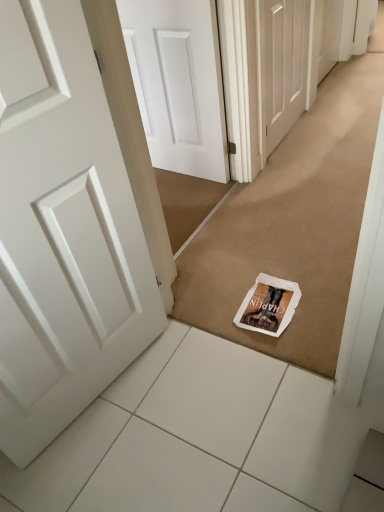
Question: Is white paper doormat at center completely or partially inside white matte door at center, arranged as the 1th door when viewed from the top?

Choices:
 (A) yes
 (B) no

Answer: (B)

Question: Is white matte door at center, acting as the second door starting from the left, completely or partially outside of white paper doormat at center?

Choices:
 (A) no
 (B) yes

Answer: (B)

Question: Can you confirm if white matte door at center, acting as the second door starting from the left, is wider than white paper doormat at center?

Choices:
 (A) yes
 (B) no

Answer: (B)

Question: From a real-world perspective, is white matte door at center, acting as the second door starting from the left, on top of white paper doormat at center?

Choices:
 (A) yes
 (B) no

Answer: (A)

Question: From the image's perspective, is white matte door at center, positioned as the 1th door in back-to-front order, beneath white paper doormat at center?

Choices:
 (A) no
 (B) yes

Answer: (A)

Question: From the image's perspective, is white matte door at center, arranged as the 1th door when viewed from the top, above or below white tile at lower center?

Choices:
 (A) above
 (B) below

Answer: (A)

Question: Would you say white matte door at center, positioned as the 1th door in back-to-front order, is inside or outside white tile at lower center?

Choices:
 (A) outside
 (B) inside

Answer: (A)

Question: Visually, is white matte door at center, acting as the second door starting from the left, positioned to the left or to the right of white tile at lower center?

Choices:
 (A) right
 (B) left

Answer: (A)

Question: From a real-world perspective, is white matte door at center, arranged as the second door when ordered from the bottom, physically located above or below white tile at lower center?

Choices:
 (A) below
 (B) above

Answer: (B)

Question: From the image's perspective, relative to white matte door at center, marked as the 1th door in a right-to-left arrangement, is white paper magazine at center above or below?

Choices:
 (A) above
 (B) below

Answer: (B)

Question: Is white paper magazine at center situated inside white matte door at center, which ranks as the 2th door in front-to-back order, or outside?

Choices:
 (A) inside
 (B) outside

Answer: (B)

Question: Considering their positions, is white paper magazine at center located in front of or behind white matte door at center, arranged as the 1th door when viewed from the top?

Choices:
 (A) front
 (B) behind

Answer: (A)

Question: From a real-world perspective, is white paper magazine at center physically located above or below white matte door at center, arranged as the 1th door when viewed from the top?

Choices:
 (A) below
 (B) above

Answer: (A)

Question: Is white matte door at center, marked as the 1th door in a right-to-left arrangement, wider or thinner than white paper magazine at center?

Choices:
 (A) thin
 (B) wide

Answer: (A)

Question: Choose the correct answer: Is white matte door at center, acting as the second door starting from the left, inside white paper magazine at center or outside it?

Choices:
 (A) outside
 (B) inside

Answer: (A)